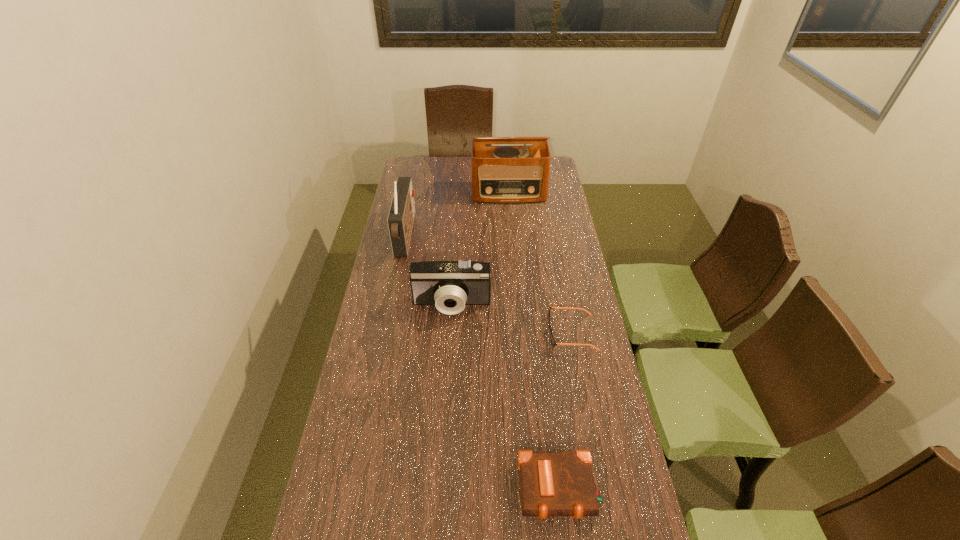
This screenshot has height=540, width=960. What are the coordinates of `the farthest object` in the screenshot? It's located at (500, 174).

Where is `the right radio receiver`? The image size is (960, 540). the right radio receiver is located at coordinates (500, 174).

You are a GUI agent. You are given a task and a screenshot of the screen. Output one action in this format:
    pyautogui.click(x=<x>, y=<y>)
    Task: Click on the leftmost object
    The height and width of the screenshot is (540, 960).
    Given the screenshot: What is the action you would take?
    pyautogui.click(x=401, y=215)

In order to click on the left radio receiver in this screenshot , I will do `click(401, 215)`.

You are a GUI agent. You are given a task and a screenshot of the screen. Output one action in this format:
    pyautogui.click(x=<x>, y=<y>)
    Task: Click on the camcorder
    The width and height of the screenshot is (960, 540).
    Given the screenshot: What is the action you would take?
    pyautogui.click(x=449, y=285)

Where is `the second shortest object`? The image size is (960, 540). the second shortest object is located at coordinates (551, 483).

Where is `the nearest object`? The image size is (960, 540). the nearest object is located at coordinates (551, 483).

I want to click on the shortest object, so click(x=554, y=343).

Find the location of a particular element. vacant area situated on the front panel of the farthest object is located at coordinates (512, 227).

Where is `vacant space located on the front panel of the fourth nearest object`? vacant space located on the front panel of the fourth nearest object is located at coordinates (502, 235).